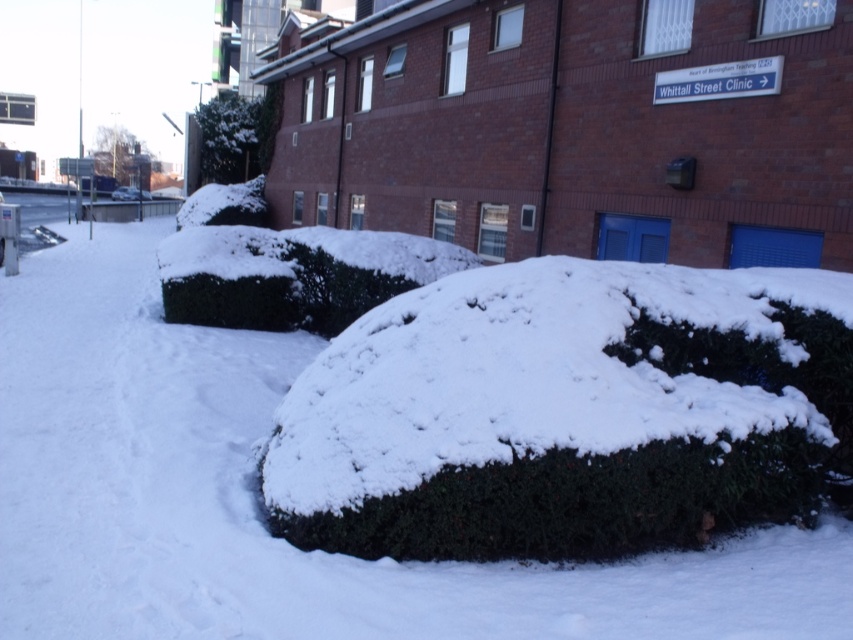
Does green textured bush at center appear on the left side of metallic silver car at center?

No, green textured bush at center is not to the left of metallic silver car at center.

Who is more forward, (296, 541) or (132, 189)?

Positioned in front is point (296, 541).

The height and width of the screenshot is (640, 853). In order to click on green textured bush at center in this screenshot , I will do `click(561, 412)`.